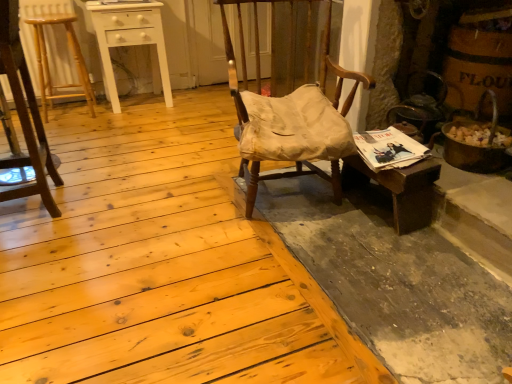
Locate an element on the screen. The width and height of the screenshot is (512, 384). free space behind wooden stool at left, the first chair in the left-to-right sequence is located at coordinates (88, 170).